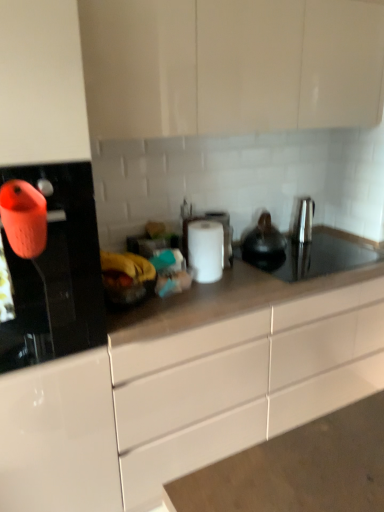
Question: From a real-world perspective, is satin nickel faucet at right physically below orange matte kettle at left?

Choices:
 (A) yes
 (B) no

Answer: (A)

Question: From the image's perspective, is satin nickel faucet at right on orange matte kettle at left?

Choices:
 (A) yes
 (B) no

Answer: (A)

Question: Considering the relative positions of satin nickel faucet at right and orange matte kettle at left in the image provided, is satin nickel faucet at right to the left of orange matte kettle at left from the viewer's perspective?

Choices:
 (A) no
 (B) yes

Answer: (A)

Question: Would you say satin nickel faucet at right is outside orange matte kettle at left?

Choices:
 (A) yes
 (B) no

Answer: (A)

Question: Is satin nickel faucet at right beside orange matte kettle at left?

Choices:
 (A) no
 (B) yes

Answer: (A)

Question: Can you confirm if satin nickel faucet at right is taller than orange matte kettle at left?

Choices:
 (A) no
 (B) yes

Answer: (A)

Question: Does satin nickel faucet at right have a greater height compared to black matte tea pot at center?

Choices:
 (A) yes
 (B) no

Answer: (A)

Question: Is satin nickel faucet at right oriented away from black matte tea pot at center?

Choices:
 (A) yes
 (B) no

Answer: (B)

Question: Can you confirm if satin nickel faucet at right is positioned to the right of black matte tea pot at center?

Choices:
 (A) yes
 (B) no

Answer: (A)

Question: Would you say satin nickel faucet at right is a long distance from black matte tea pot at center?

Choices:
 (A) yes
 (B) no

Answer: (B)

Question: From the image's perspective, is satin nickel faucet at right under black matte tea pot at center?

Choices:
 (A) yes
 (B) no

Answer: (B)

Question: Is satin nickel faucet at right oriented towards black matte tea pot at center?

Choices:
 (A) no
 (B) yes

Answer: (A)

Question: Does matte white cabinets at upper center, the 1th cabinetry from the top, have a lesser width compared to satin nickel faucet at right?

Choices:
 (A) yes
 (B) no

Answer: (B)